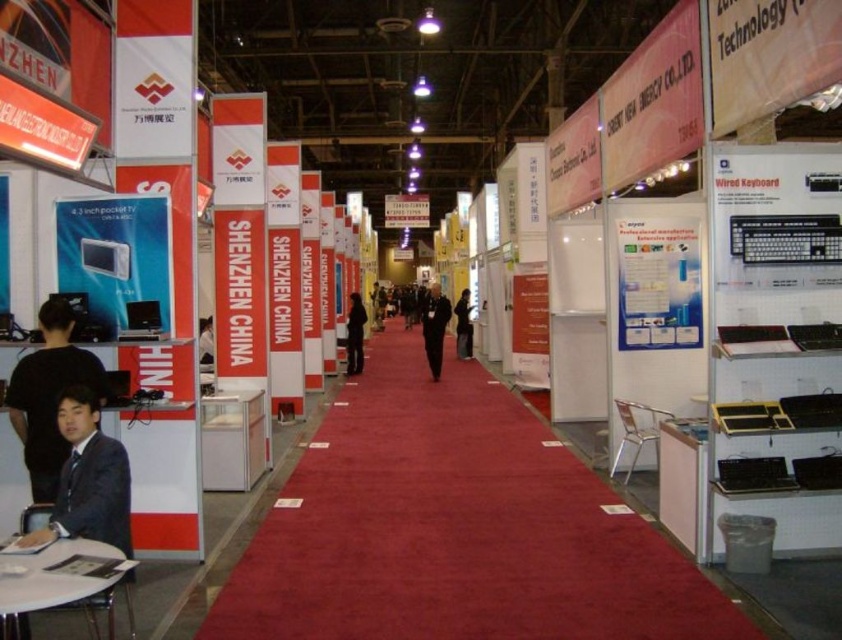
Question: Which of the following is the closest to the observer?

Choices:
 (A) (347, 355)
 (B) (445, 310)
 (C) (466, 333)

Answer: (A)

Question: Does black matte suit at center have a lesser width compared to dark fabric jacket at center?

Choices:
 (A) yes
 (B) no

Answer: (B)

Question: Which object is the closest to the black matte suit at center?

Choices:
 (A) black fabric coat at center
 (B) dark fabric jacket at center
 (C) black suit at lower left

Answer: (B)

Question: Does black matte suit at center appear on the right side of dark fabric jacket at center?

Choices:
 (A) no
 (B) yes

Answer: (B)

Question: Which object is positioned farthest from the black matte suit at center?

Choices:
 (A) dark fabric jacket at center
 (B) black fabric coat at center
 (C) black suit at lower left

Answer: (C)

Question: Is black suit at lower left wider than black matte suit at center?

Choices:
 (A) no
 (B) yes

Answer: (A)